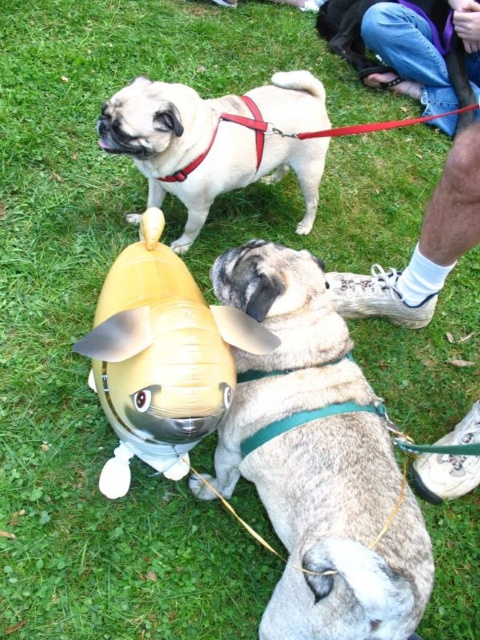
Is white socks at lower right bigger than smooth black dog at upper center?

Actually, white socks at lower right might be smaller than smooth black dog at upper center.

Is point (452, 204) closer to camera compared to point (468, 93)?

Yes.

Does point (389, 52) come behind point (436, 33)?

No, it is in front of (436, 33).

Find the location of `white socks at lower right`. white socks at lower right is located at coordinates (423, 246).

Does fuzzy beige dog at lower center come behind white socks at lower right?

No, fuzzy beige dog at lower center is in front of white socks at lower right.

Is fuzzy beige dog at lower center bigger than white socks at lower right?

Yes, fuzzy beige dog at lower center is bigger than white socks at lower right.

At what (x,y) coordinates should I click in order to perform the action: click on fuzzy beige dog at lower center. Please return your answer as a coordinate pair (x, y). Looking at the image, I should click on (317, 460).

Locate an element on the screen. The width and height of the screenshot is (480, 640). fuzzy beige dog at lower center is located at coordinates click(x=317, y=460).

How much distance is there between matte beige dog at upper center and smooth black dog at upper center?

They are 4.62 feet apart.

What do you see at coordinates (217, 141) in the screenshot? The image size is (480, 640). I see `matte beige dog at upper center` at bounding box center [217, 141].

This screenshot has height=640, width=480. Identify the location of matte beige dog at upper center. (217, 141).